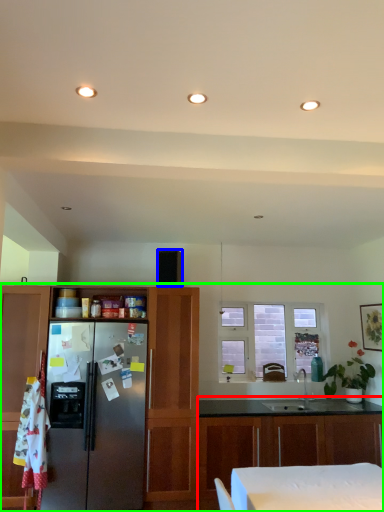
Question: Estimate the real-world distances between objects in this image. Which object is farther from cabinetry (highlighted by a red box), appliance (highlighted by a blue box) or cabinetry (highlighted by a green box)?

Choices:
 (A) appliance
 (B) cabinetry

Answer: (A)